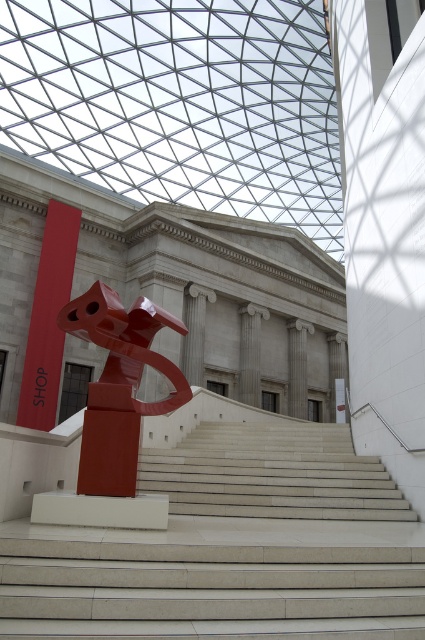
Question: Which object appears closest to the camera in this image?

Choices:
 (A) matte red sign at left
 (B) white marble stairs at center
 (C) matte red sculpture at center

Answer: (B)

Question: Which object appears closest to the camera in this image?

Choices:
 (A) white marble stairs at center
 (B) matte red sign at left

Answer: (A)

Question: Where is white marble stairs at center located in relation to matte red sign at left in the image?

Choices:
 (A) left
 (B) right

Answer: (B)

Question: Can you confirm if matte red sculpture at center is wider than matte red sign at left?

Choices:
 (A) yes
 (B) no

Answer: (A)

Question: Can you confirm if matte red sculpture at center is smaller than matte red sign at left?

Choices:
 (A) no
 (B) yes

Answer: (B)

Question: Which point is closer to the camera taking this photo?

Choices:
 (A) (105, 368)
 (B) (300, 449)

Answer: (A)